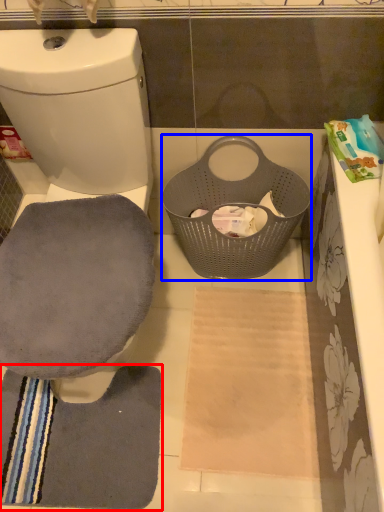
Question: Which of the following is the farthest to the observer, bath towel (highlighted by a red box) or basket (highlighted by a blue box)?

Choices:
 (A) bath towel
 (B) basket

Answer: (A)